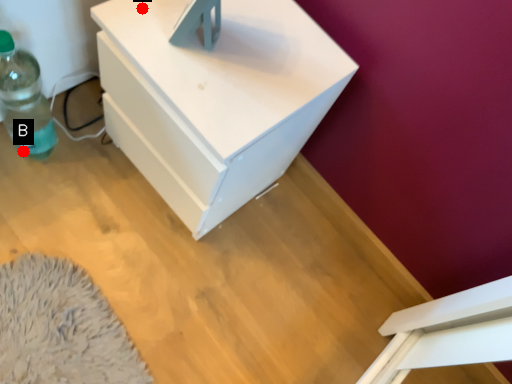
Question: Two points are circled on the image, labeled by A and B beside each circle. Which point is farther from the camera taking this photo?

Choices:
 (A) A is further
 (B) B is further

Answer: (B)